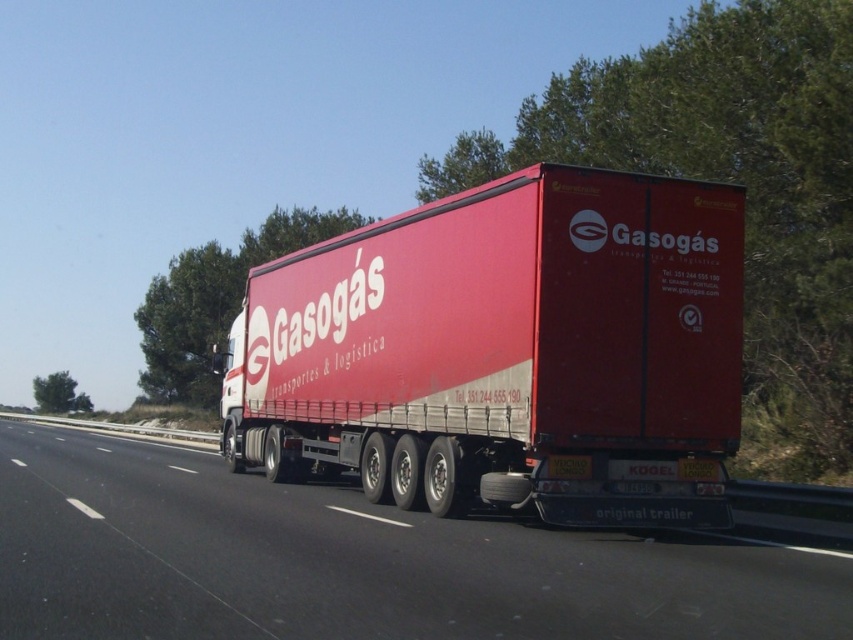
Does matte red trailer truck at center have a greater width compared to metallic trailer at center?

Incorrect, matte red trailer truck at center's width does not surpass metallic trailer at center's.

Which is behind, point (326, 305) or point (18, 493)?

Point (326, 305)

You are a GUI agent. You are given a task and a screenshot of the screen. Output one action in this format:
    pyautogui.click(x=<x>, y=<y>)
    Task: Click on the matte red trailer truck at center
    The image size is (853, 640).
    Given the screenshot: What is the action you would take?
    pos(508,352)